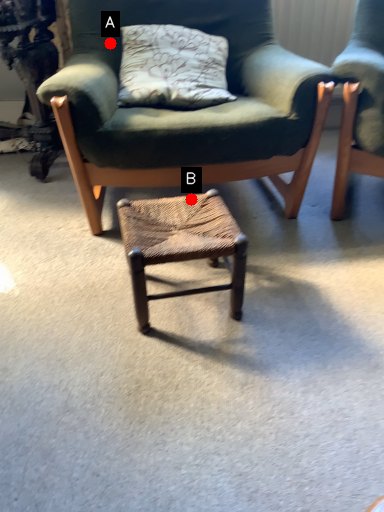
Question: Two points are circled on the image, labeled by A and B beside each circle. Among these points, which one is nearest to the camera?

Choices:
 (A) A is closer
 (B) B is closer

Answer: (B)